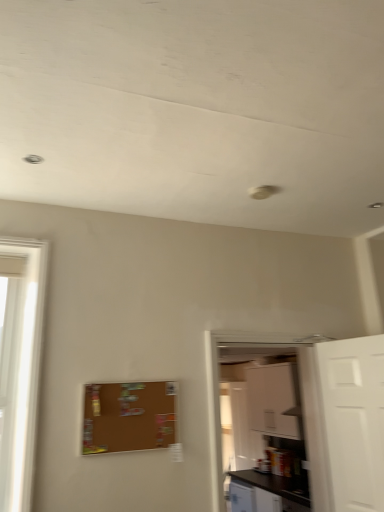
Question: From a real-world perspective, is white matte door at right on top of corkboard at center?

Choices:
 (A) no
 (B) yes

Answer: (A)

Question: Considering the relative positions of white matte door at right and corkboard at center in the image provided, is white matte door at right in front of corkboard at center?

Choices:
 (A) yes
 (B) no

Answer: (A)

Question: From the image's perspective, is white matte door at right located beneath corkboard at center?

Choices:
 (A) yes
 (B) no

Answer: (A)

Question: Is the surface of white matte door at right in direct contact with corkboard at center?

Choices:
 (A) yes
 (B) no

Answer: (B)

Question: Would you say corkboard at center is part of white matte door at right's contents?

Choices:
 (A) no
 (B) yes

Answer: (A)

Question: From the image's perspective, relative to corkboard at center, is white glossy cabinet at right above or below?

Choices:
 (A) below
 (B) above

Answer: (A)

Question: Is white glossy cabinet at right situated inside corkboard at center or outside?

Choices:
 (A) outside
 (B) inside

Answer: (A)

Question: From a real-world perspective, is white glossy cabinet at right above or below corkboard at center?

Choices:
 (A) below
 (B) above

Answer: (A)

Question: Considering their positions, is white glossy cabinet at right located in front of or behind corkboard at center?

Choices:
 (A) front
 (B) behind

Answer: (B)

Question: Choose the correct answer: Is black laminate counter top at lower right inside white matte cabinet at upper right or outside it?

Choices:
 (A) inside
 (B) outside

Answer: (B)

Question: From the image's perspective, is black laminate counter top at lower right located above or below white matte cabinet at upper right?

Choices:
 (A) below
 (B) above

Answer: (A)

Question: Considering their positions, is black laminate counter top at lower right located in front of or behind white matte cabinet at upper right?

Choices:
 (A) behind
 (B) front

Answer: (A)

Question: Would you say black laminate counter top at lower right is to the left or to the right of white matte cabinet at upper right in the picture?

Choices:
 (A) left
 (B) right

Answer: (A)

Question: From the image's perspective, is black laminate counter top at lower right positioned above or below corkboard at center?

Choices:
 (A) below
 (B) above

Answer: (A)

Question: Is point (289, 478) closer or farther from the camera than point (110, 436)?

Choices:
 (A) closer
 (B) farther

Answer: (B)